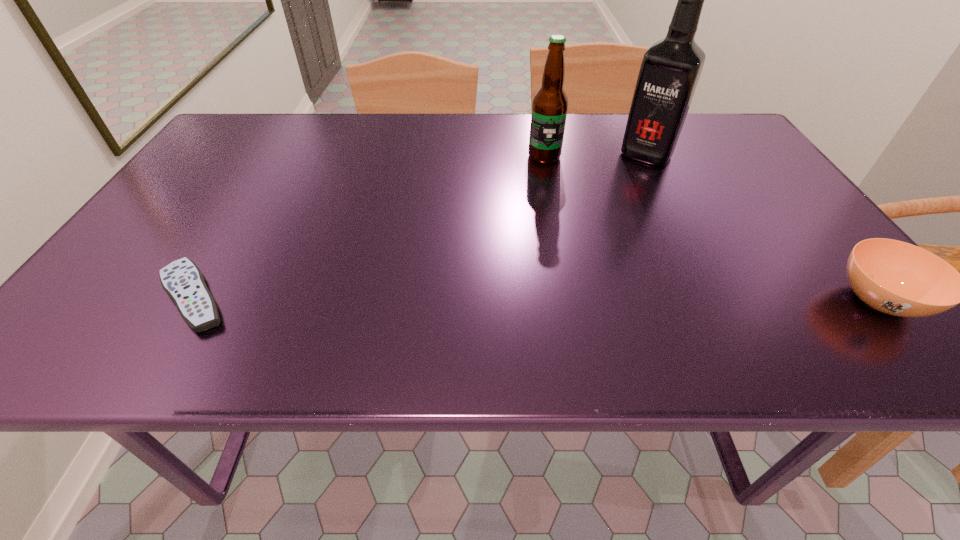
Find the location of `vacant space located on the front-facing side of the liquor`. vacant space located on the front-facing side of the liquor is located at coordinates (604, 212).

Find the location of a particular element. This screenshot has width=960, height=540. vacant space located on the front-facing side of the liquor is located at coordinates (610, 203).

Locate an element on the screen. blank area located 0.120m on the front-facing side of the liquor is located at coordinates (620, 188).

Locate an element on the screen. The image size is (960, 540). free region located 0.120m on the label of the second tallest object is located at coordinates (539, 192).

Image resolution: width=960 pixels, height=540 pixels. I want to click on vacant space located 0.070m on the label of the second tallest object, so (x=540, y=180).

This screenshot has height=540, width=960. I want to click on free space located on the label of the second tallest object, so click(x=536, y=210).

You are a GUI agent. You are given a task and a screenshot of the screen. Output one action in this format:
    pyautogui.click(x=<x>, y=<y>)
    Task: Click on the liquor located in the far edge section of the desktop
    Image resolution: width=960 pixels, height=540 pixels.
    Given the screenshot: What is the action you would take?
    pyautogui.click(x=670, y=70)

You are a GUI agent. You are given a task and a screenshot of the screen. Output one action in this format:
    pyautogui.click(x=<x>, y=<y>)
    Task: Click on the beer bottle present at the far edge
    Image resolution: width=960 pixels, height=540 pixels.
    Given the screenshot: What is the action you would take?
    pyautogui.click(x=550, y=104)

The image size is (960, 540). In order to click on remote control that is at the near edge in this screenshot , I will do `click(182, 280)`.

The height and width of the screenshot is (540, 960). What are the coordinates of `soup bowl that is positioned at the near edge` in the screenshot? It's located at (897, 278).